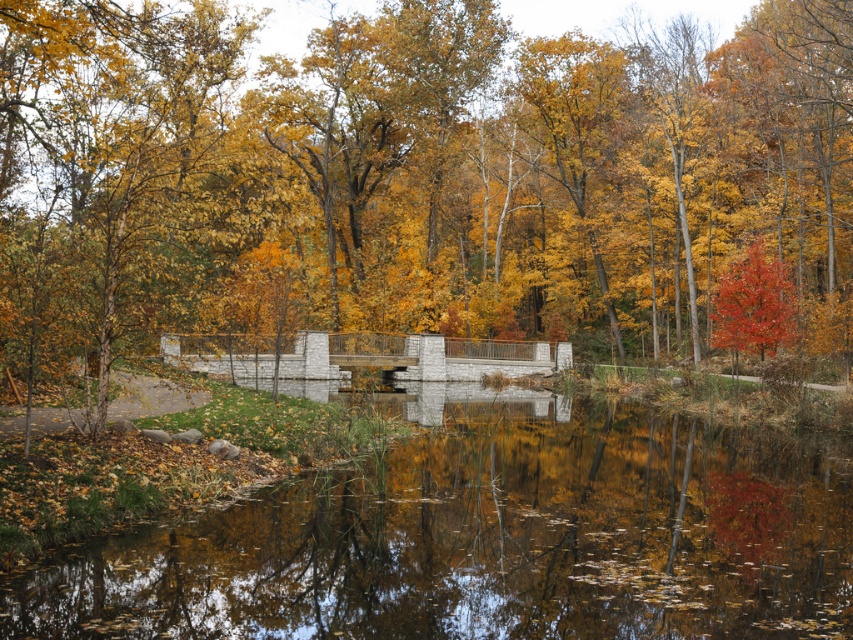
You are a hiker who wants to cross the smooth concrete lake at center. You have a 15 meter long rope. Can you use the shiny red tree at right as an anchor point to safely cross the lake?

The distance between the smooth concrete lake at center and the shiny red tree at right is 17.74 meters. Since the rope is only 15 meters long, it is not long enough to reach from the lake to the tree. Therefore, you cannot safely use the shiny red tree at right as an anchor point.

You are standing on the stone bridge and looking down at the golden yellow leaves at center and the smooth concrete lake at center. Which object appears taller from your viewpoint?

The golden yellow leaves at center appear taller than the smooth concrete lake at center because the description states that the golden yellow leaves at center has a greater height compared to the smooth concrete lake at center.

Consider the image. You are standing on the stone bridge and want to pick up the golden yellow leaves at center and the shiny red tree at right. Which object is closer to your right side?

The shiny red tree at right is closer to your right side because it is positioned to the right of the golden yellow leaves at center.